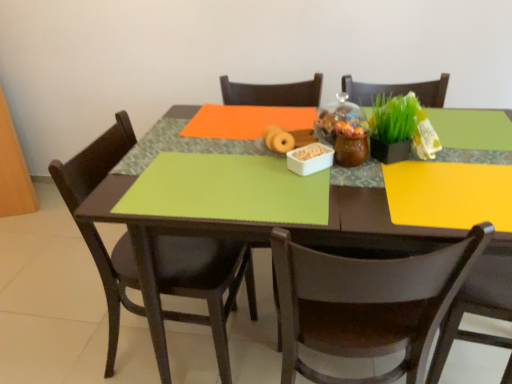
Describe the element at coordinates (206, 283) in the screenshot. This screenshot has width=512, height=384. I see `matte black chair at left, which ranks as the first chair in left-to-right order` at that location.

This screenshot has height=384, width=512. Identify the location of brown wooden chair at lower right, the 2th chair from the left. (366, 304).

In terms of size, does matte black chair at left, which is the 2th chair in right-to-left order, appear bigger or smaller than green matte table at center?

In the image, matte black chair at left, which is the 2th chair in right-to-left order, appears to be smaller than green matte table at center.

From the image's perspective, is matte black chair at left, which ranks as the first chair in left-to-right order, located above or below green matte table at center?

From the image's perspective, matte black chair at left, which ranks as the first chair in left-to-right order, appears above green matte table at center.

Considering the relative positions of matte black chair at left, which ranks as the first chair in left-to-right order, and green matte table at center in the image provided, is matte black chair at left, which ranks as the first chair in left-to-right order, behind green matte table at center?

Yes.

Does point (226, 309) come farther from viewer compared to point (373, 210)?

That is True.

I want to click on chair that appears in front of the green matte placemat at center, so click(366, 304).

From the image's perspective, which one is positioned higher, brown wooden chair at lower right, the 1th chair when ordered from right to left, or green matte placemat at center?

green matte placemat at center, from the image's perspective.

Consider the image. Is brown wooden chair at lower right, the 2th chair from the left, wider than green matte placemat at center?

Correct, the width of brown wooden chair at lower right, the 2th chair from the left, exceeds that of green matte placemat at center.

In the scene shown: Is green matte placemat at center aimed at matte brown donut at center?

No, green matte placemat at center does not turn towards matte brown donut at center.

Is the depth of green matte placemat at center greater than that of matte brown donut at center?

No.

Does green matte placemat at center touch matte brown donut at center?

green matte placemat at center is not next to matte brown donut at center, and they're not touching.

From a real-world perspective, count 1st chairs downward from the matte brown donut at center and point to it. Please provide its 2D coordinates.

[(366, 304)]

Is matte brown donut at center aimed at brown wooden chair at lower right, the 2th chair from the left?

Yes.

From the image's perspective, between matte brown donut at center and brown wooden chair at lower right, the 2th chair from the left, who is located below?

brown wooden chair at lower right, the 2th chair from the left, from the image's perspective.

Would you say matte brown donut at center is a long distance from brown wooden chair at lower right, the 1th chair when ordered from right to left?

Actually, matte brown donut at center and brown wooden chair at lower right, the 1th chair when ordered from right to left, are a little close together.

From the image's perspective, which is above, matte black chair at left, which ranks as the first chair in left-to-right order, or matte brown donut at center?

matte brown donut at center appears higher in the image.

Is matte black chair at left, which is the 2th chair in right-to-left order, situated inside matte brown donut at center or outside?

The correct answer is: outside.

Is matte black chair at left, which is the 2th chair in right-to-left order, oriented towards matte brown donut at center?

Yes, matte black chair at left, which is the 2th chair in right-to-left order, is facing matte brown donut at center.

The image size is (512, 384). In order to click on the 1st chair in front when counting from the matte brown donut at center in this screenshot , I will do (x=206, y=283).

Is green matte table at center in front of matte brown donut at center?

Yes, it is in front of matte brown donut at center.

From the image's perspective, which one is positioned higher, green matte table at center or matte brown donut at center?

From the image's view, matte brown donut at center is above.

Looking at this image, is matte brown donut at center at the back of green matte table at center?

No.

Does point (353, 227) appear closer or farther from the camera than point (267, 140)?

Point (353, 227).

Is brown wooden chair at lower right, the 1th chair when ordered from right to left, smaller than green matte table at center?

Yes, brown wooden chair at lower right, the 1th chair when ordered from right to left, is smaller than green matte table at center.

I want to click on table that appears on the left of brown wooden chair at lower right, the 2th chair from the left, so click(370, 225).

Can you confirm if brown wooden chair at lower right, the 1th chair when ordered from right to left, is shorter than green matte table at center?

No.

Are brown wooden chair at lower right, the 1th chair when ordered from right to left, and green matte table at center beside each other?

brown wooden chair at lower right, the 1th chair when ordered from right to left, and green matte table at center are not in contact.

Locate an element on the screen. The width and height of the screenshot is (512, 384). chair above the green matte table at center (from the image's perspective) is located at coordinates (206, 283).

Where is `chair on the right of green matte placemat at center`? This screenshot has height=384, width=512. chair on the right of green matte placemat at center is located at coordinates point(366,304).

From the image, which object appears to be farther from green matte placemat at center, matte brown donut at center or matte black chair at left, which ranks as the first chair in left-to-right order?

Based on the image, matte black chair at left, which ranks as the first chair in left-to-right order, appears to be further to green matte placemat at center.

Considering their positions, is matte black chair at left, which ranks as the first chair in left-to-right order, positioned further to green matte placemat at center than brown wooden chair at lower right, the 2th chair from the left?

Among the two, matte black chair at left, which ranks as the first chair in left-to-right order, is located further to green matte placemat at center.

When comparing their distances from brown wooden chair at lower right, the 1th chair when ordered from right to left, does green matte placemat at center or matte brown donut at center seem closer?

Among the two, green matte placemat at center is located nearer to brown wooden chair at lower right, the 1th chair when ordered from right to left.

When comparing their distances from green matte table at center, does matte brown donut at center or green matte placemat at center seem closer?

The object closer to green matte table at center is green matte placemat at center.

From the image, which object appears to be farther from green matte placemat at center, matte brown donut at center or green matte table at center?

matte brown donut at center is positioned further to the anchor green matte placemat at center.

From the image, which object appears to be nearer to green matte placemat at center, matte black chair at left, which ranks as the first chair in left-to-right order, or green matte table at center?

Based on the image, green matte table at center appears to be nearer to green matte placemat at center.

Looking at the image, which one is located closer to matte brown donut at center, brown wooden chair at lower right, the 2th chair from the left, or matte black chair at left, which ranks as the first chair in left-to-right order?

The object closer to matte brown donut at center is brown wooden chair at lower right, the 2th chair from the left.

From the image, which object appears to be farther from matte black chair at left, which is the 2th chair in right-to-left order, green matte placemat at center or brown wooden chair at lower right, the 1th chair when ordered from right to left?

brown wooden chair at lower right, the 1th chair when ordered from right to left.

The height and width of the screenshot is (384, 512). I want to click on food between matte black chair at left, which ranks as the first chair in left-to-right order, and green matte table at center, so click(x=278, y=139).

Locate an element on the screen. This screenshot has width=512, height=384. tablecloth that lies between matte brown donut at center and green matte table at center from top to bottom is located at coordinates (472, 130).

The image size is (512, 384). I want to click on tablecloth between matte brown donut at center and brown wooden chair at lower right, the 1th chair when ordered from right to left, from top to bottom, so click(x=472, y=130).

You are a GUI agent. You are given a task and a screenshot of the screen. Output one action in this format:
    pyautogui.click(x=<x>, y=<y>)
    Task: Click on the table between green matte placemat at center and brown wooden chair at lower right, the 1th chair when ordered from right to left, from top to bottom
    
    Given the screenshot: What is the action you would take?
    pyautogui.click(x=370, y=225)